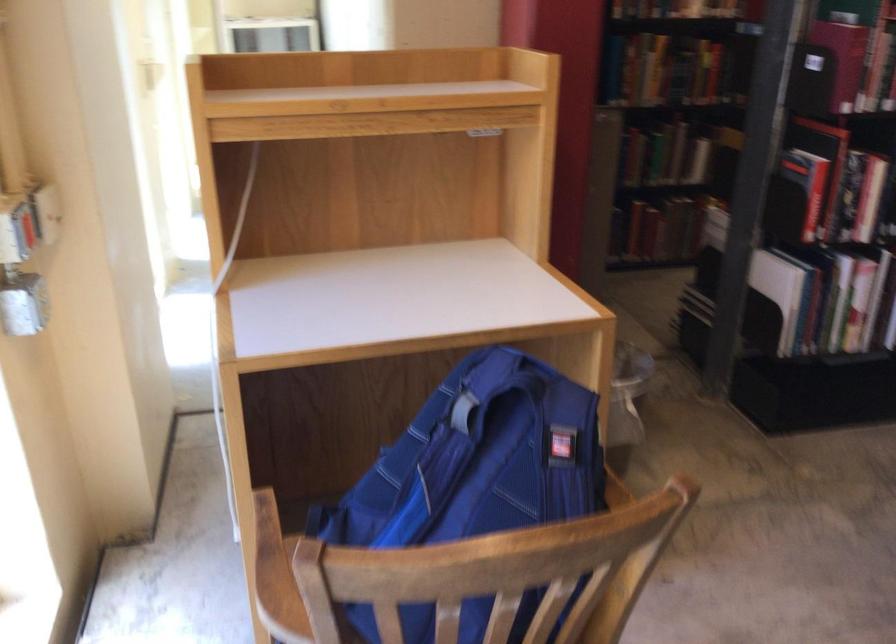
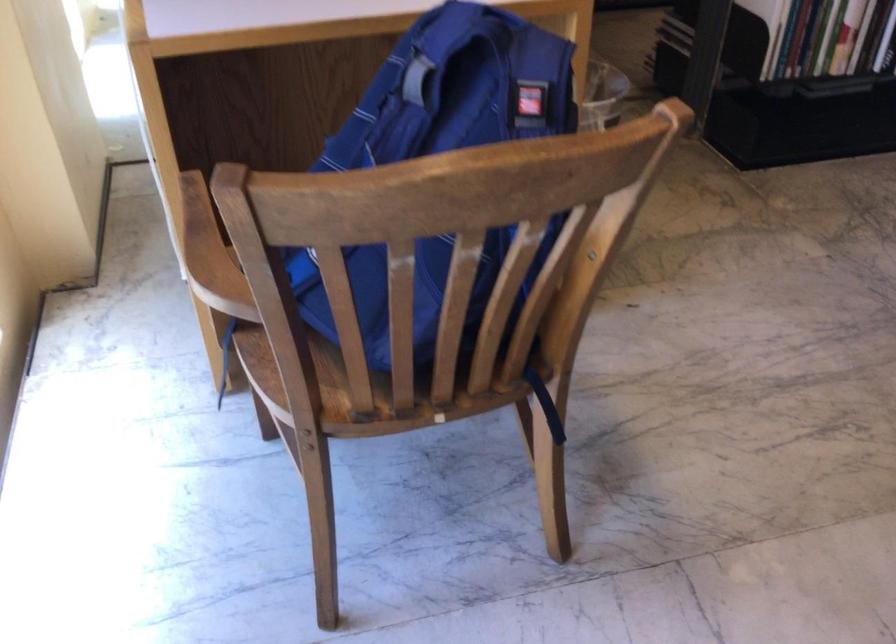
Question: The images are taken continuously from a first-person perspective. In which direction are you moving?

Choices:
 (A) Left
 (B) Right
 (C) Forward
 (D) Backward

Answer: (C)